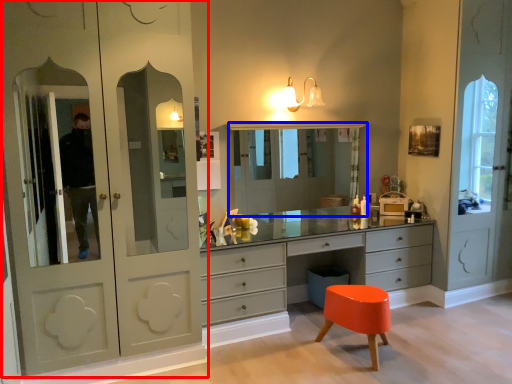
Question: Which object appears closest to the camera in this image, cupboard (highlighted by a red box) or medicine cabinet (highlighted by a blue box)?

Choices:
 (A) cupboard
 (B) medicine cabinet

Answer: (A)